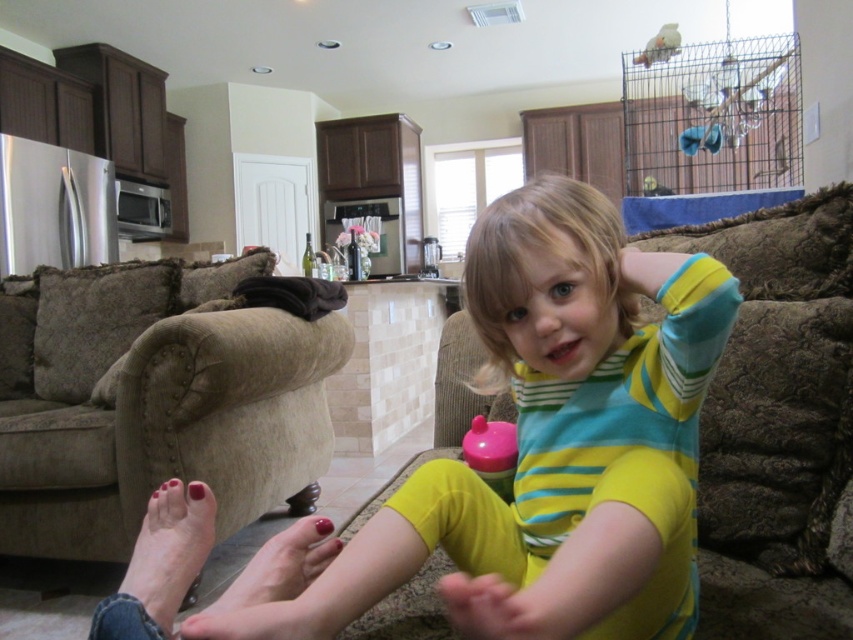
Question: Which point appears closest to the camera in this image?

Choices:
 (A) (67, 552)
 (B) (256, 579)
 (C) (608, 456)
 (D) (538, 438)

Answer: (B)

Question: From the image, what is the correct spatial relationship of matte skin foot at lower left in relation to smooth skin foot at lower left?

Choices:
 (A) above
 (B) below

Answer: (A)

Question: Which object is farther from the camera taking this photo?

Choices:
 (A) smooth skin foot at lower left
 (B) yellow striped shirt at center
 (C) matte skin foot at lower left
 (D) brown textured couch at center

Answer: (A)

Question: Can you confirm if brown textured couch at center is wider than smooth skin foot at lower left?

Choices:
 (A) yes
 (B) no

Answer: (A)

Question: Which object is the closest to the matte skin foot at lower left?

Choices:
 (A) smooth skin foot at lower left
 (B) beige fabric couch at left
 (C) yellow striped shirt at center
 (D) brown textured couch at center

Answer: (A)

Question: Does brown textured couch at center lie behind smooth skin foot at lower left?

Choices:
 (A) no
 (B) yes

Answer: (A)